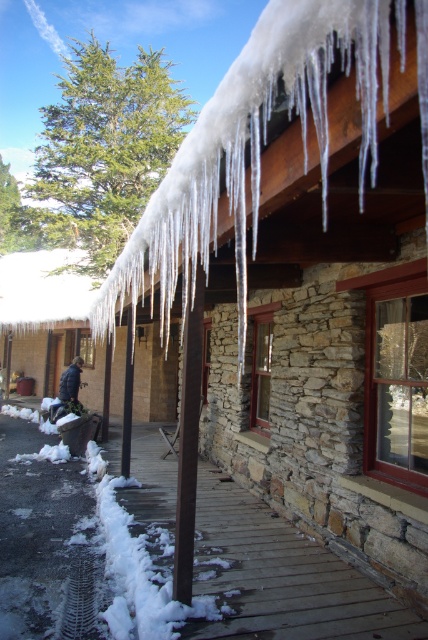
Can you confirm if icy white snow at upper center is smaller than white snow-covered roof at upper left?

Actually, icy white snow at upper center might be larger than white snow-covered roof at upper left.

Looking at this image, is icy white snow at upper center positioned at the back of white snow-covered roof at upper left?

No, icy white snow at upper center is in front of white snow-covered roof at upper left.

Where is `icy white snow at upper center`? The width and height of the screenshot is (428, 640). icy white snow at upper center is located at coordinates (250, 147).

Is icy white snow at upper center positioned before dark blue jacket at lower left?

Yes, it is.

Identify the location of icy white snow at upper center. The width and height of the screenshot is (428, 640). (250, 147).

Which is above, white snow-covered roof at upper left or dark blue jacket at lower left?

white snow-covered roof at upper left is above.

Can you confirm if white snow-covered roof at upper left is positioned to the right of dark blue jacket at lower left?

In fact, white snow-covered roof at upper left is to the left of dark blue jacket at lower left.

Is point (68, 298) farther from camera compared to point (77, 401)?

Yes.

Image resolution: width=428 pixels, height=640 pixels. Identify the location of white snow-covered roof at upper left. (44, 289).